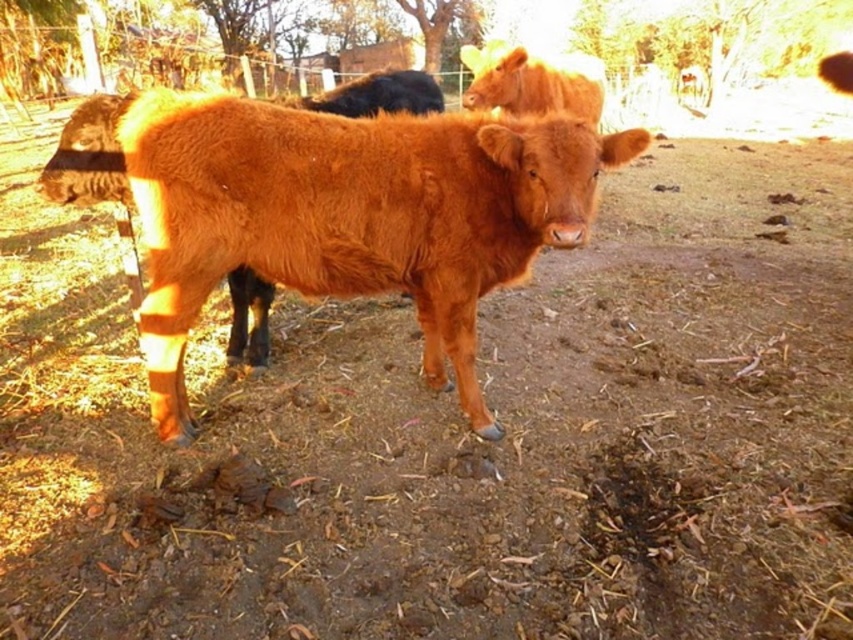
Question: Can you confirm if brown woolly bull at center is wider than shiny brown bull at upper center?

Choices:
 (A) yes
 (B) no

Answer: (A)

Question: Does brown woolly bull at center have a larger size compared to shiny brown bull at upper center?

Choices:
 (A) yes
 (B) no

Answer: (A)

Question: Which point appears farthest from the camera in this image?

Choices:
 (A) (477, 102)
 (B) (474, 145)

Answer: (A)

Question: Does brown woolly bull at center appear on the left side of shiny brown bull at upper center?

Choices:
 (A) yes
 (B) no

Answer: (A)

Question: Which point is farther to the camera?

Choices:
 (A) (222, 225)
 (B) (486, 51)

Answer: (B)